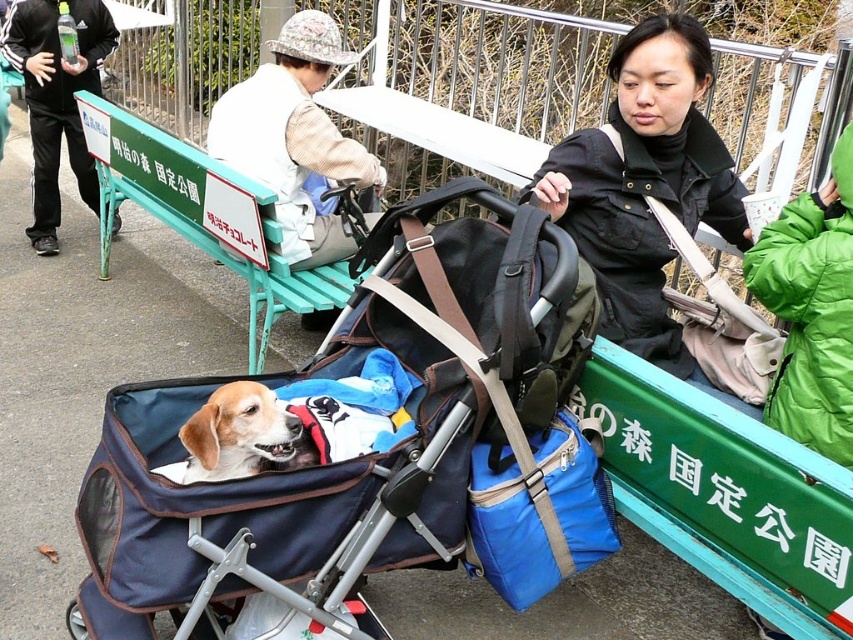
You are a park visitor who wants to place a small backpack on the green plastic bench at upper center and the blue fabric cooler at center. Based on their positions, which object allows you to place the backpack without it falling off?

The green plastic bench at upper center is above the blue fabric cooler at center, so placing the backpack on the green plastic bench at upper center would prevent it from falling off since it is higher.

Looking at this image, what is the 2D coordinate of the blue fabric baby carriage at center?

The blue fabric baby carriage at center is located at the 2D coordinate point of (x=346, y=460).